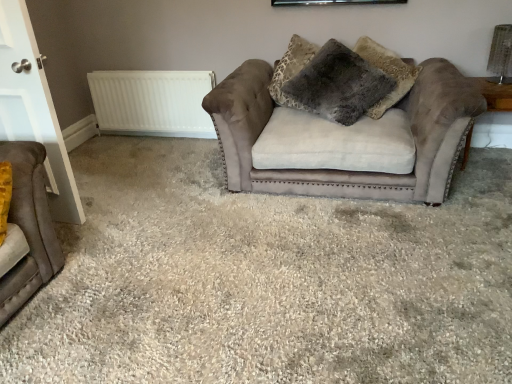
Measure the distance between point (291, 45) and camera.

They are 3.29 meters apart.

What do you see at coordinates (345, 139) in the screenshot? I see `suede-like beige couch at center, which appears as the 1th studio couch when viewed from the right` at bounding box center [345, 139].

This screenshot has width=512, height=384. What do you see at coordinates (152, 102) in the screenshot?
I see `white matte radiator at upper left` at bounding box center [152, 102].

Image resolution: width=512 pixels, height=384 pixels. What do you see at coordinates (29, 228) in the screenshot?
I see `velvet brown studio couch at left, the 1th studio couch positioned from the front` at bounding box center [29, 228].

Measure the distance between point (31, 54) and camera.

The depth of point (31, 54) is 2.15 meters.

What do you see at coordinates (267, 280) in the screenshot?
I see `suede couch at center` at bounding box center [267, 280].

Find the location of a particular element. The image size is (512, 384). wooden side table at right is located at coordinates click(x=497, y=93).

Which object is closer to the camera, velvet brown studio couch at left, marked as the 2th studio couch in a back-to-front arrangement, or white glossy door at left?

velvet brown studio couch at left, marked as the 2th studio couch in a back-to-front arrangement, is more forward.

From the image's perspective, is velvet brown studio couch at left, positioned as the 2th studio couch in right-to-left order, over white glossy door at left?

No, from the image's perspective, velvet brown studio couch at left, positioned as the 2th studio couch in right-to-left order, is not over white glossy door at left.

Considering the sizes of objects velvet brown studio couch at left, the 1th studio couch positioned from the front, and white glossy door at left in the image provided, who is thinner, velvet brown studio couch at left, the 1th studio couch positioned from the front, or white glossy door at left?

white glossy door at left.

From a real-world perspective, which is physically below, velvet brown studio couch at left, the 1th studio couch when ordered from left to right, or white glossy door at left?

In real-world perspective, velvet brown studio couch at left, the 1th studio couch when ordered from left to right, is lower.

From a real-world perspective, is suede-like beige couch at center, placed as the first studio couch when sorted from back to front, positioned under fuzzy gray pillow at center based on gravity?

Correct, in the physical world, suede-like beige couch at center, placed as the first studio couch when sorted from back to front, is lower than fuzzy gray pillow at center.

Is suede-like beige couch at center, which appears as the 1th studio couch when viewed from the right, smaller than fuzzy gray pillow at center?

No, suede-like beige couch at center, which appears as the 1th studio couch when viewed from the right, is not smaller than fuzzy gray pillow at center.

In the scene shown: From the image's perspective, who appears lower, suede-like beige couch at center, which appears as the 1th studio couch when viewed from the right, or fuzzy gray pillow at center?

suede-like beige couch at center, which appears as the 1th studio couch when viewed from the right, is shown below in the image.

Is suede-like beige couch at center, arranged as the second studio couch when viewed from the front, outside of fuzzy gray pillow at center?

That's correct, suede-like beige couch at center, arranged as the second studio couch when viewed from the front, is outside of fuzzy gray pillow at center.

Is suede couch at center facing away from white glossy door at left?

That's not correct — suede couch at center is not looking away from white glossy door at left.

Who is taller, suede couch at center or white glossy door at left?

With more height is white glossy door at left.

Is suede couch at center smaller than white glossy door at left?

No, suede couch at center is not smaller than white glossy door at left.

Consider the image. From the image's perspective, is suede couch at center under white glossy door at left?

Yes, from the image's perspective, suede couch at center is below white glossy door at left.

Is white matte radiator at upper left closer to the viewer compared to white glossy door at left?

That is False.

Considering the sizes of objects white matte radiator at upper left and white glossy door at left in the image provided, who is thinner, white matte radiator at upper left or white glossy door at left?

Thinner between the two is white matte radiator at upper left.

Is white matte radiator at upper left oriented towards white glossy door at left?

Yes, white matte radiator at upper left is oriented towards white glossy door at left.

Is point (122, 92) closer or farther from the camera than point (17, 124)?

Clearly, point (122, 92) is more distant from the camera than point (17, 124).

Does velvet brown studio couch at left, positioned as the 2th studio couch in right-to-left order, have a larger size compared to suede couch at center?

No, velvet brown studio couch at left, positioned as the 2th studio couch in right-to-left order, is not bigger than suede couch at center.

Locate an element on the screen. Image resolution: width=512 pixels, height=384 pixels. the 1st studio couch above when counting from the suede couch at center (from the image's perspective) is located at coordinates click(29, 228).

Could you tell me if velvet brown studio couch at left, marked as the 2th studio couch in a back-to-front arrangement, is facing suede couch at center?

No, velvet brown studio couch at left, marked as the 2th studio couch in a back-to-front arrangement, is not aimed at suede couch at center.

Are velvet brown studio couch at left, the 1th studio couch positioned from the front, and suede couch at center making contact?

No.

Considering the positions of objects white glossy door at left and suede-like beige couch at center, placed as the 2th studio couch when sorted from left to right, in the image provided, who is more to the left, white glossy door at left or suede-like beige couch at center, placed as the 2th studio couch when sorted from left to right,?

Positioned to the left is white glossy door at left.

Is there a large distance between white glossy door at left and suede-like beige couch at center, placed as the first studio couch when sorted from back to front?

Yes, white glossy door at left and suede-like beige couch at center, placed as the first studio couch when sorted from back to front, are located far from each other.

Is suede-like beige couch at center, placed as the 2th studio couch when sorted from left to right, at the back of white glossy door at left?

white glossy door at left does not have its back to suede-like beige couch at center, placed as the 2th studio couch when sorted from left to right.

At what (x,y) coordinates should I click in order to perform the action: click on door above the suede-like beige couch at center, placed as the 2th studio couch when sorted from left to right (from a real-world perspective). Please return your answer as a coordinate pair (x, y). The height and width of the screenshot is (384, 512). Looking at the image, I should click on (33, 107).

Relative to white matte radiator at upper left, is suede couch at center in front or behind?

suede couch at center is positioned closer to the viewer than white matte radiator at upper left.

Is point (179, 215) positioned after point (167, 129)?

No, it is not.

In the image, there is a white glossy door at left. What are the coordinates of `studio couch below it (from the image's perspective)` in the screenshot? It's located at (29, 228).

At what (x,y) coordinates should I click in order to perform the action: click on studio couch that is on the right side of fuzzy gray pillow at center. Please return your answer as a coordinate pair (x, y). The image size is (512, 384). Looking at the image, I should click on (345, 139).

Looking at the image, which one is located closer to fuzzy gray pillow at center, velvet brown studio couch at left, the 1th studio couch positioned from the front, or suede couch at center?

suede couch at center lies closer to fuzzy gray pillow at center than the other object.

Looking at this image, looking at the image, which one is located further to wooden side table at right, white glossy door at left or suede couch at center?

Among the two, white glossy door at left is located further to wooden side table at right.

Based on their spatial positions, is wooden side table at right or white glossy door at left closer to suede couch at center?

Based on the image, white glossy door at left appears to be nearer to suede couch at center.

Looking at the image, which one is located closer to wooden side table at right, white matte radiator at upper left or fuzzy gray pillow at center?

Based on the image, fuzzy gray pillow at center appears to be nearer to wooden side table at right.

Consider the image. Which object lies further to the anchor point white matte radiator at upper left, wooden side table at right or suede-like beige couch at center, placed as the first studio couch when sorted from back to front?

Among the two, wooden side table at right is located further to white matte radiator at upper left.

When comparing their distances from white glossy door at left, does suede couch at center or suede-like beige couch at center, placed as the 2th studio couch when sorted from left to right, seem further?

suede-like beige couch at center, placed as the 2th studio couch when sorted from left to right, is further to white glossy door at left.

Estimate the real-world distances between objects in this image. Which object is closer to wooden side table at right, suede-like beige couch at center, which appears as the 1th studio couch when viewed from the right, or suede couch at center?

suede-like beige couch at center, which appears as the 1th studio couch when viewed from the right, is closer to wooden side table at right.

Based on their spatial positions, is velvet brown studio couch at left, the 1th studio couch positioned from the front, or white glossy door at left further from white matte radiator at upper left?

Based on the image, velvet brown studio couch at left, the 1th studio couch positioned from the front, appears to be further to white matte radiator at upper left.

The width and height of the screenshot is (512, 384). Find the location of `plain between white glossy door at left and wooden side table at right`. plain between white glossy door at left and wooden side table at right is located at coordinates (267, 280).

Find the location of a particular element. The width and height of the screenshot is (512, 384). pillow between velvet brown studio couch at left, marked as the 2th studio couch in a back-to-front arrangement, and wooden side table at right is located at coordinates (331, 81).

Where is `pillow between velvet brown studio couch at left, positioned as the 2th studio couch in right-to-left order, and suede-like beige couch at center, placed as the first studio couch when sorted from back to front, in the horizontal direction`? The image size is (512, 384). pillow between velvet brown studio couch at left, positioned as the 2th studio couch in right-to-left order, and suede-like beige couch at center, placed as the first studio couch when sorted from back to front, in the horizontal direction is located at coordinates (331, 81).

Locate an element on the screen. The height and width of the screenshot is (384, 512). plain between white matte radiator at upper left and wooden side table at right is located at coordinates (267, 280).